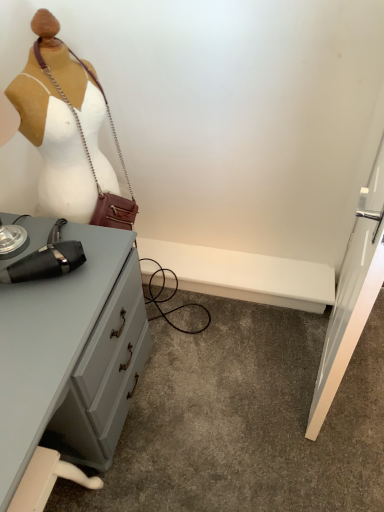
What do you see at coordinates (69, 362) in the screenshot? This screenshot has height=512, width=384. I see `matte gray desk at left` at bounding box center [69, 362].

You are a GUI agent. You are given a task and a screenshot of the screen. Output one action in this format:
    pyautogui.click(x=<x>, y=<y>)
    Task: Click on the matte gray desk at left
    Image resolution: width=384 pixels, height=512 pixels.
    Given the screenshot: What is the action you would take?
    (x=69, y=362)

Measure the distance between point (x=104, y=207) and camera.

A distance of 4.58 feet exists between point (x=104, y=207) and camera.

You are a GUI agent. You are given a task and a screenshot of the screen. Output one action in this format:
    pyautogui.click(x=<x>, y=<y>)
    Task: Click on the matte black hairdryer at left
    The image size is (384, 512).
    Given the screenshot: What is the action you would take?
    pyautogui.click(x=92, y=162)

This screenshot has width=384, height=512. Describe the element at coordinates (92, 162) in the screenshot. I see `matte black hairdryer at left` at that location.

Where is `matte gray desk at left`? This screenshot has width=384, height=512. matte gray desk at left is located at coordinates (69, 362).

Is matte black hairdryer at left at the left side of matte gray desk at left?

Incorrect, matte black hairdryer at left is not on the left side of matte gray desk at left.

Looking at this image, which object is closer to the camera, matte black hairdryer at left or matte gray desk at left?

matte gray desk at left is in front.

Considering the points (116, 198) and (40, 366), which point is behind, point (116, 198) or point (40, 366)?

The point (116, 198) is behind.

From the image's perspective, does matte black hairdryer at left appear higher than matte gray desk at left?

Yes.

From a real-world perspective, is matte black hairdryer at left below matte gray desk at left?

Incorrect, from a real-world perspective, matte black hairdryer at left is higher than matte gray desk at left.

Is matte black hairdryer at left thinner than matte gray desk at left?

Indeed, matte black hairdryer at left has a lesser width compared to matte gray desk at left.

Is matte black hairdryer at left taller or shorter than matte gray desk at left?

In the image, matte black hairdryer at left appears to be taller than matte gray desk at left.

Can you confirm if matte black hairdryer at left is bigger than matte gray desk at left?

No, matte black hairdryer at left is not bigger than matte gray desk at left.

Is matte gray desk at left inside matte black hairdryer at left?

No.

Are matte black hairdryer at left and matte gray desk at left far apart?

No.

Is matte black hairdryer at left facing away from matte gray desk at left?

matte black hairdryer at left does not have its back to matte gray desk at left.

Where is `accessory behind the matte gray desk at left`? Image resolution: width=384 pixels, height=512 pixels. accessory behind the matte gray desk at left is located at coordinates (92, 162).

Considering the positions of objects matte gray desk at left and matte black hairdryer at left in the image provided, who is more to the right, matte gray desk at left or matte black hairdryer at left?

matte black hairdryer at left is more to the right.

Is matte gray desk at left further to the viewer compared to matte black hairdryer at left?

No, the depth of matte gray desk at left is less than that of matte black hairdryer at left.

Which is closer, (x=96, y=230) or (x=47, y=69)?

The point (x=47, y=69) is in front.

From the image's perspective, who appears lower, matte gray desk at left or matte black hairdryer at left?

From the image's view, matte gray desk at left is below.

From a real-world perspective, which is physically below, matte gray desk at left or matte black hairdryer at left?

In real-world perspective, matte gray desk at left is lower.

Which of these two, matte gray desk at left or matte black hairdryer at left, is wider?

Wider between the two is matte gray desk at left.

From the picture: Which of these two, matte gray desk at left or matte black hairdryer at left, stands shorter?

matte gray desk at left is shorter.

Can you confirm if matte gray desk at left is smaller than matte black hairdryer at left?

Actually, matte gray desk at left might be larger than matte black hairdryer at left.

Can we say matte gray desk at left lies outside matte black hairdryer at left?

matte gray desk at left lies outside matte black hairdryer at left's area.

Is matte gray desk at left touching matte black hairdryer at left?

There is a gap between matte gray desk at left and matte black hairdryer at left.

Is matte gray desk at left turned away from matte black hairdryer at left?

No, matte black hairdryer at left is not at the back of matte gray desk at left.

Where is `accessory behind the matte gray desk at left`? Image resolution: width=384 pixels, height=512 pixels. accessory behind the matte gray desk at left is located at coordinates (92, 162).

Where is `desk below the matte black hairdryer at left (from a real-world perspective)`? Image resolution: width=384 pixels, height=512 pixels. desk below the matte black hairdryer at left (from a real-world perspective) is located at coordinates (69, 362).

Locate an element on the screen. Image resolution: width=384 pixels, height=512 pixels. accessory behind the matte gray desk at left is located at coordinates coord(92,162).